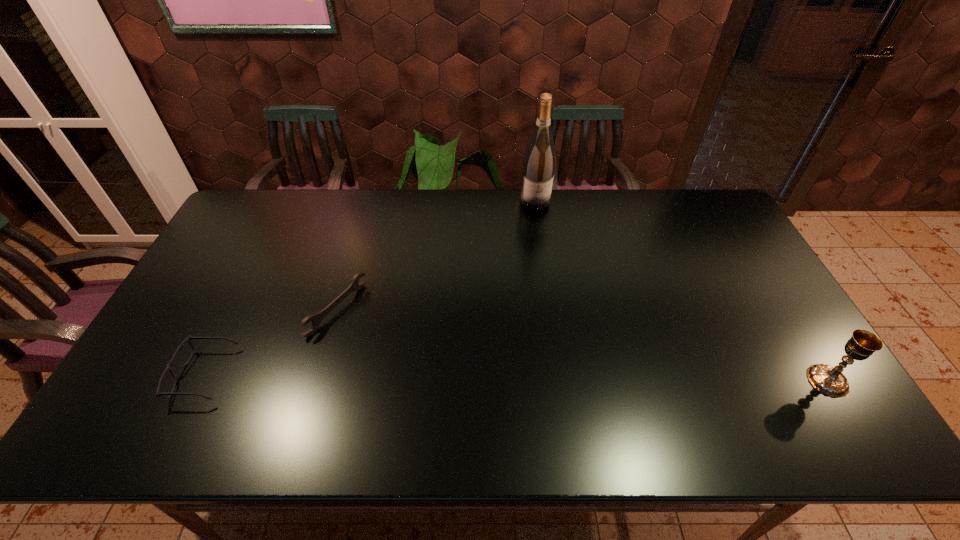
Locate an element on the screen. the leftmost object is located at coordinates (x=158, y=393).

Find the location of `the second tallest object`. the second tallest object is located at coordinates tap(829, 380).

Where is `the rightmost object`? This screenshot has height=540, width=960. the rightmost object is located at coordinates (829, 380).

Find the location of a particular element. This screenshot has height=540, width=960. the second object from right to left is located at coordinates (538, 168).

Locate an element on the screen. The height and width of the screenshot is (540, 960). the tallest object is located at coordinates (538, 168).

Identify the location of the second farthest object. The image size is (960, 540). (317, 318).

Find the location of a particular element. wrench is located at coordinates (317, 318).

This screenshot has width=960, height=540. In order to click on vacant space located 0.100m on the front-facing side of the spectacles in this screenshot , I will do [135, 375].

Identify the location of free space located 0.400m on the back of the chalice. (751, 257).

Where is `vacant area situated 0.090m on the label of the farthest object`? Image resolution: width=960 pixels, height=540 pixels. vacant area situated 0.090m on the label of the farthest object is located at coordinates (540, 227).